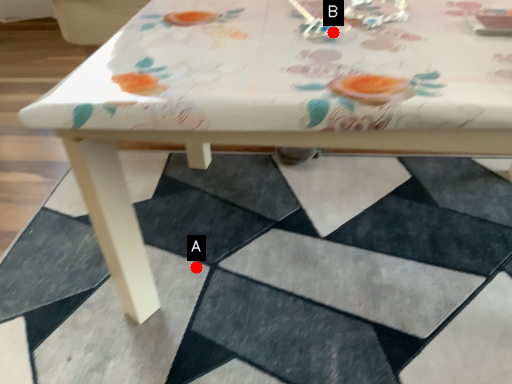
Question: Two points are circled on the image, labeled by A and B beside each circle. Which point appears farthest from the camera in this image?

Choices:
 (A) A is further
 (B) B is further

Answer: (A)